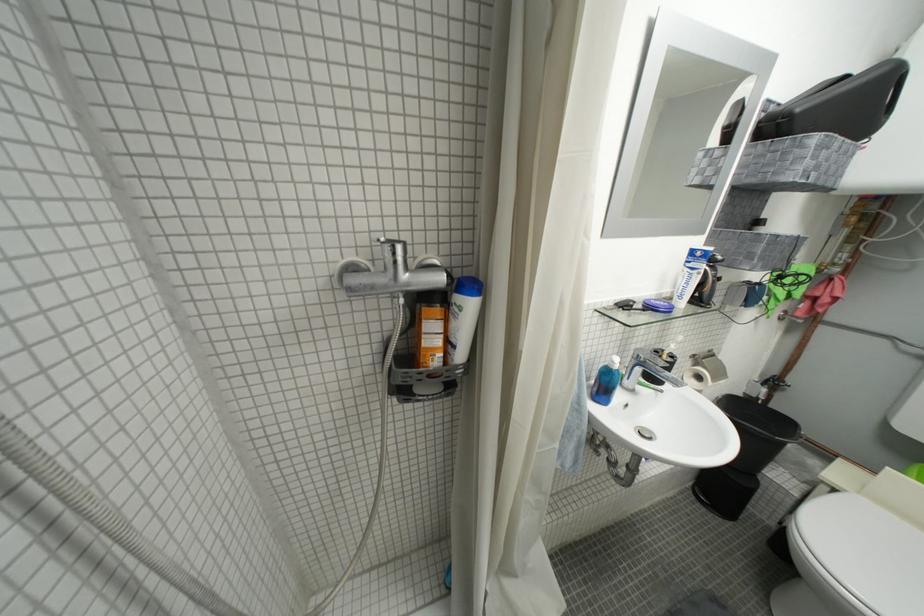
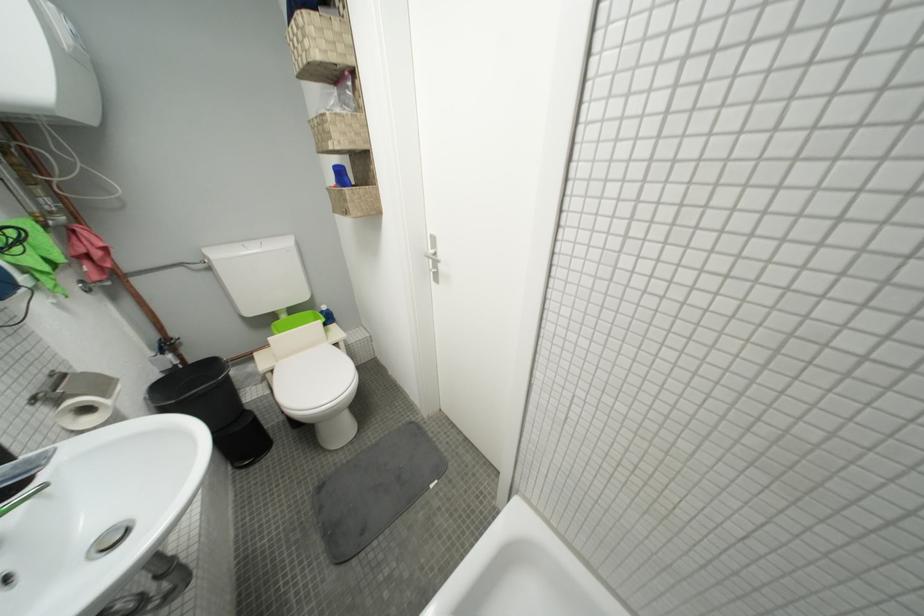
Where in the second image is the point corresponding to [782,384] from the first image?

(175, 347)